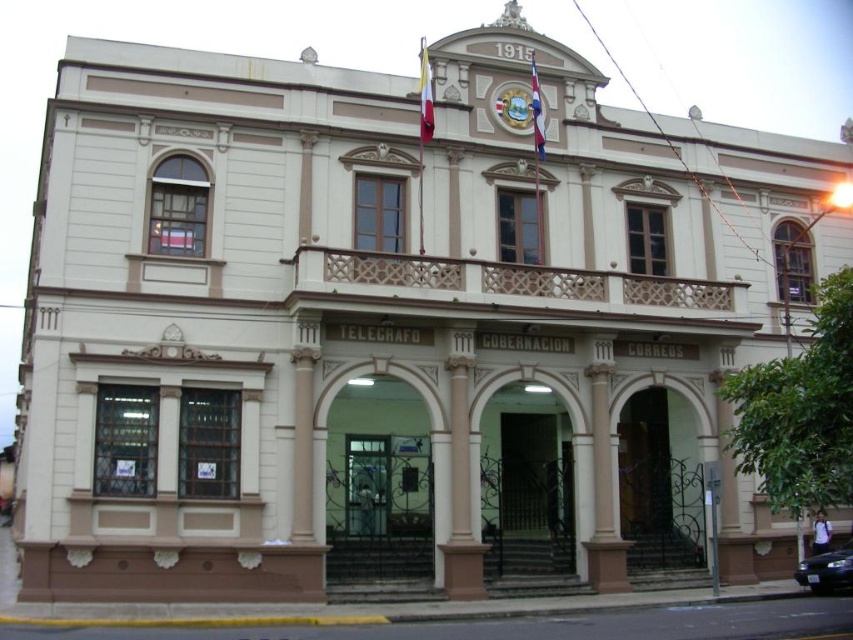
Does white marble column at center have a greater height compared to shiny black sedan at lower right?

Yes, white marble column at center is taller than shiny black sedan at lower right.

Is white marble column at center positioned at the back of shiny black sedan at lower right?

That is False.

Describe the element at coordinates (302, 444) in the screenshot. I see `white marble column at center` at that location.

Identify the location of white marble column at center. point(302,444).